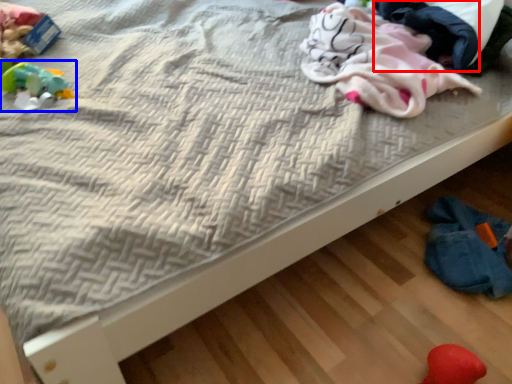
Question: Among these objects, which one is nearest to the camera, clothing (highlighted by a red box) or toy (highlighted by a blue box)?

Choices:
 (A) clothing
 (B) toy

Answer: (A)